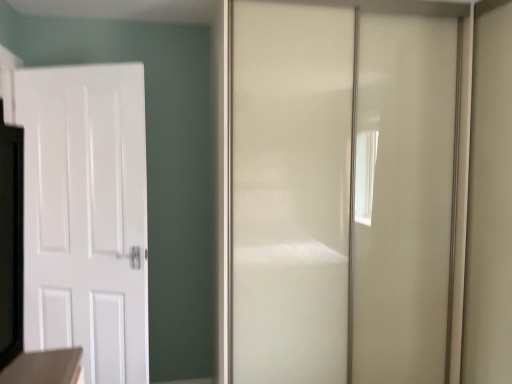
Question: In terms of width, does glossy white door at center, placed as the second door when sorted from left to right, look wider or thinner when compared to white matte door at left, which ranks as the 2th door in right-to-left order?

Choices:
 (A) thin
 (B) wide

Answer: (B)

Question: Is glossy white door at center, the first door positioned from the right, taller or shorter than white matte door at left, which appears as the first door when viewed from the left?

Choices:
 (A) tall
 (B) short

Answer: (A)

Question: From a real-world perspective, relative to white matte door at left, which ranks as the 2th door in right-to-left order, is glossy white door at center, placed as the second door when sorted from left to right, vertically above or below?

Choices:
 (A) below
 (B) above

Answer: (B)

Question: Is white matte door at left, which ranks as the 2th door in right-to-left order, bigger or smaller than glossy white door at center, the first door positioned from the right?

Choices:
 (A) small
 (B) big

Answer: (A)

Question: From a real-world perspective, is white matte door at left, which appears as the first door when viewed from the left, above or below glossy white door at center, placed as the second door when sorted from left to right?

Choices:
 (A) below
 (B) above

Answer: (A)

Question: Considering their positions, is white matte door at left, which appears as the first door when viewed from the left, located in front of or behind glossy white door at center, placed as the second door when sorted from left to right?

Choices:
 (A) behind
 (B) front

Answer: (A)

Question: In terms of height, does white matte door at left, which ranks as the 2th door in right-to-left order, look taller or shorter compared to glossy white door at center, placed as the second door when sorted from left to right?

Choices:
 (A) tall
 (B) short

Answer: (B)